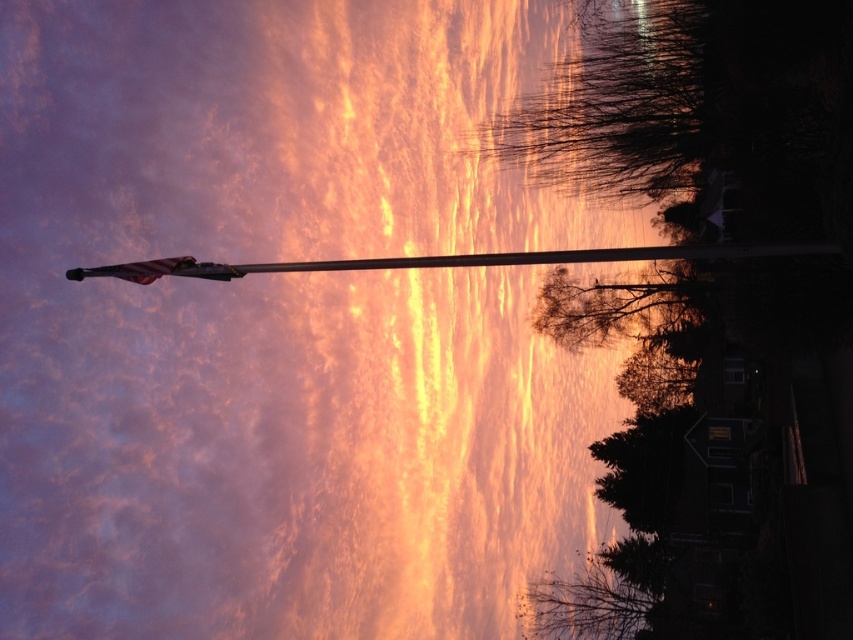
In the scene shown: You are a photographer trying to capture the sunset scene. You notice the metallic flag pole at center and the american flag at upper left. Which object is closer to you, the photographer?

The metallic flag pole at center is closer to you because it is in front of the american flag at upper left.

You are a photographer planning to capture the sunset scene. You want to ensure both the metallic flag pole at center and the american flag at upper left are clearly visible in your shot. Based on their positioning, which object should you focus on first to ensure both are in frame?

The metallic flag pole at center is positioned over the american flag at upper left, so focusing on the metallic flag pole at center first will ensure both are in frame as the flag pole is closer to the viewer.